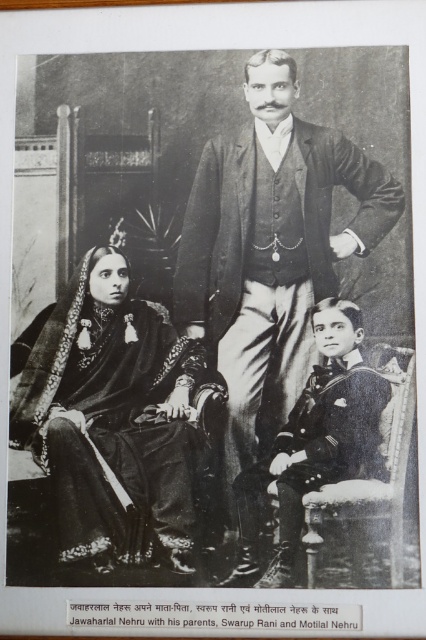
Question: Which point appears farthest from the camera in this image?

Choices:
 (A) (112, 372)
 (B) (241, 342)

Answer: (B)

Question: Is smooth black suit at center in front of sailor suit at lower right?

Choices:
 (A) no
 (B) yes

Answer: (A)

Question: Which point is closer to the camera taking this photo?

Choices:
 (A) (109, 570)
 (B) (374, 464)

Answer: (A)

Question: Is smooth black suit at center below sailor suit at lower right?

Choices:
 (A) yes
 (B) no

Answer: (B)

Question: Which point is closer to the camera taking this photo?

Choices:
 (A) (46, 349)
 (B) (299, 388)

Answer: (B)

Question: Is velvet black shawl at center above sailor suit at lower right?

Choices:
 (A) yes
 (B) no

Answer: (A)